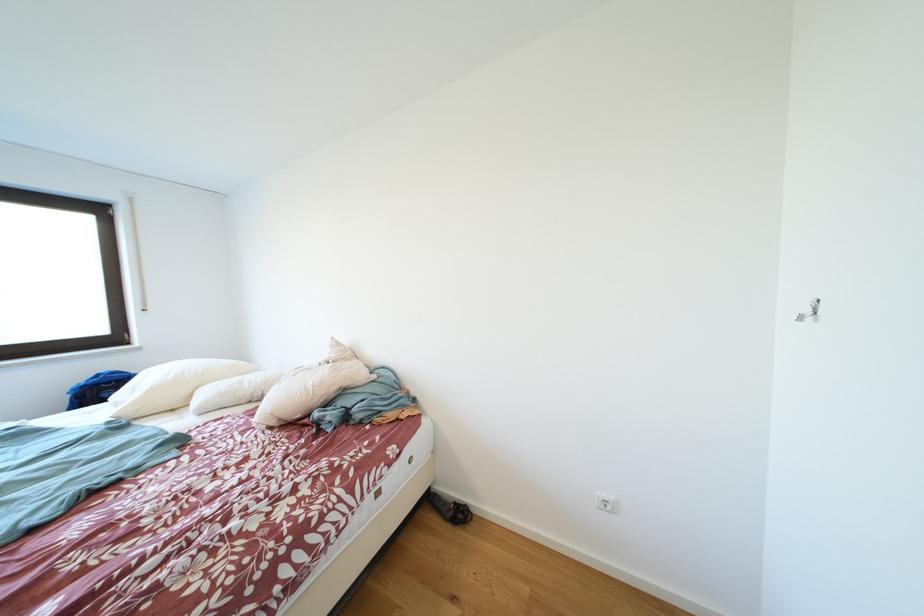
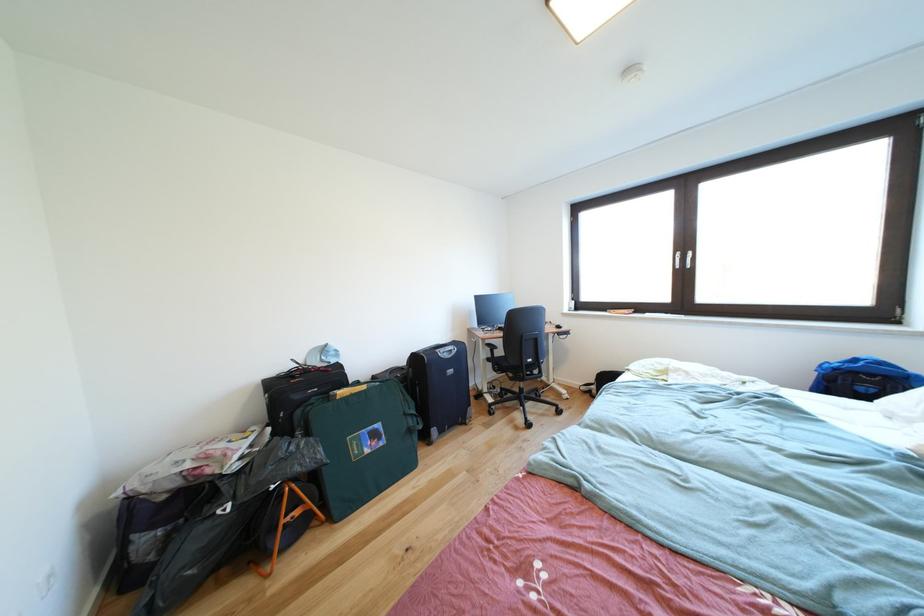
Question: Based on the continuous images, in which direction is the camera rotating? Reply with the corresponding letter.

Choices:
 (A) Left
 (B) Right
 (C) Up
 (D) Down

Answer: (A)